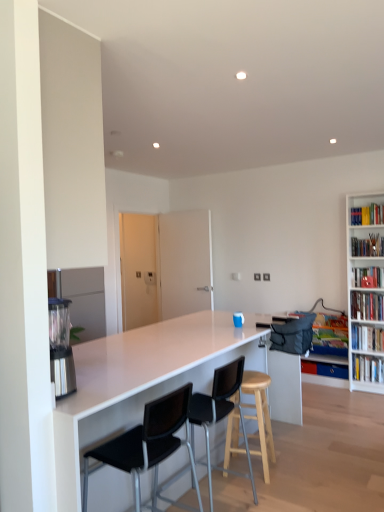
This screenshot has height=512, width=384. What do you see at coordinates (220, 414) in the screenshot? I see `black plastic chair at center, arranged as the 2th chair when viewed from the front` at bounding box center [220, 414].

Where is `black plastic chair at center, acting as the first chair starting from the back`? The height and width of the screenshot is (512, 384). black plastic chair at center, acting as the first chair starting from the back is located at coordinates (220, 414).

Locate an element on the screen. This screenshot has height=512, width=384. white matte bookshelf at right, positioned as the 3th book in bottom-to-top order is located at coordinates (367, 338).

In order to click on hardcover book at right, acting as the 6th book starting from the top in this screenshot , I will do `click(367, 368)`.

This screenshot has width=384, height=512. I want to click on black plastic chair at center, the first chair when ordered from front to back, so click(x=148, y=444).

Describe the element at coordinates (61, 347) in the screenshot. I see `stainless steel blender at left` at that location.

This screenshot has height=512, width=384. What do you see at coordinates (367, 276) in the screenshot?
I see `hardcover book at upper right, which is the 3th book from top to bottom` at bounding box center [367, 276].

At what (x,y) coordinates should I click in order to perform the action: click on black plastic chair at center, acting as the first chair starting from the back. Please return your answer as a coordinate pair (x, y). The height and width of the screenshot is (512, 384). Looking at the image, I should click on (220, 414).

Does point (261, 396) come farther from viewer compared to point (342, 376)?

No.

Is light wood stool at center positioned far away from hardcover book at center, placed as the first book when sorted from bottom to top?

Indeed, light wood stool at center is not near hardcover book at center, placed as the first book when sorted from bottom to top.

In the scene shown: From the image's perspective, is light wood stool at center over hardcover book at center, which appears as the 7th book when viewed from the top?

Yes.

Is light wood stool at center in front of hardcover book at center, which appears as the 7th book when viewed from the top?

Yes, the depth of light wood stool at center is less than that of hardcover book at center, which appears as the 7th book when viewed from the top.

Which of these two, hardcover book at right, acting as the 6th book starting from the top, or light wood stool at center, stands taller?

light wood stool at center.

Is hardcover book at right, acting as the 6th book starting from the top, oriented towards light wood stool at center?

Yes.

Considering the relative sizes of hardcover book at right, acting as the 6th book starting from the top, and light wood stool at center in the image provided, is hardcover book at right, acting as the 6th book starting from the top, thinner than light wood stool at center?

Correct, the width of hardcover book at right, acting as the 6th book starting from the top, is less than that of light wood stool at center.

Considering the relative positions of hardcover book at right, acting as the 6th book starting from the top, and light wood stool at center in the image provided, is hardcover book at right, acting as the 6th book starting from the top, in front of light wood stool at center?

No, hardcover book at right, acting as the 6th book starting from the top, is further to the viewer.

Considering the sizes of hardcover book at center, which appears as the 7th book when viewed from the top, and light wood stool at center in the image, is hardcover book at center, which appears as the 7th book when viewed from the top, taller or shorter than light wood stool at center?

Clearly, hardcover book at center, which appears as the 7th book when viewed from the top, is shorter compared to light wood stool at center.

Which is correct: hardcover book at center, placed as the first book when sorted from bottom to top, is inside light wood stool at center, or outside of it?

hardcover book at center, placed as the first book when sorted from bottom to top, is outside light wood stool at center.

This screenshot has width=384, height=512. What are the coordinates of `the 7th book behind the light wood stool at center` in the screenshot? It's located at (324, 369).

Considering the positions of points (356, 239) and (357, 211), is point (356, 239) farther from camera compared to point (357, 211)?

No.

From a real-world perspective, which object rests below the other?

hardcover book at upper right, which appears as the second book when viewed from the top, is physically lower.

Considering the sizes of objects hardcover book at upper right, which is the sixth book in bottom-to-top order, and hardcover book at upper right, the 7th book in the bottom-to-top sequence, in the image provided, who is bigger, hardcover book at upper right, which is the sixth book in bottom-to-top order, or hardcover book at upper right, the 7th book in the bottom-to-top sequence,?

hardcover book at upper right, which is the sixth book in bottom-to-top order, is bigger.

Are hardcover book at upper right, the 7th book in the bottom-to-top sequence, and white matte bookshelf at right, marked as the fifth book in a top-to-bottom arrangement, located far from each other?

Absolutely, hardcover book at upper right, the 7th book in the bottom-to-top sequence, is distant from white matte bookshelf at right, marked as the fifth book in a top-to-bottom arrangement.

I want to click on book that is the 4th object directly below the hardcover book at upper right, the 7th book in the bottom-to-top sequence (from a real-world perspective), so click(367, 338).

From the image's perspective, is hardcover book at upper right, which is the 1th book in top-to-bottom order, above or below white matte bookshelf at right, marked as the fifth book in a top-to-bottom arrangement?

Based on their image positions, hardcover book at upper right, which is the 1th book in top-to-bottom order, is located above white matte bookshelf at right, marked as the fifth book in a top-to-bottom arrangement.

Can you confirm if hardcover book at upper right, the 7th book in the bottom-to-top sequence, is wider than white matte bookshelf at right, positioned as the 3th book in bottom-to-top order?

No.

Looking at this image, how much distance is there between white matte bookshelf at right, which appears as the 4th book when ordered from the bottom, and white matte bookshelf at right, positioned as the 3th book in bottom-to-top order?

They are 8.40 inches apart.

Considering the sizes of objects white matte bookshelf at right, acting as the 4th book starting from the top, and white matte bookshelf at right, positioned as the 3th book in bottom-to-top order, in the image provided, who is thinner, white matte bookshelf at right, acting as the 4th book starting from the top, or white matte bookshelf at right, positioned as the 3th book in bottom-to-top order,?

white matte bookshelf at right, positioned as the 3th book in bottom-to-top order.

Is the position of white matte bookshelf at right, acting as the 4th book starting from the top, more distant than that of white matte bookshelf at right, positioned as the 3th book in bottom-to-top order?

No, white matte bookshelf at right, acting as the 4th book starting from the top, is closer to the viewer.

From the image's perspective, is white matte bookshelf at right, acting as the 4th book starting from the top, on white matte bookshelf at right, positioned as the 3th book in bottom-to-top order?

Yes.

Is hardcover book at upper right, which is the 3th book from top to bottom, aimed at hardcover book at upper right, which appears as the second book when viewed from the top?

No.

Considering the sizes of objects hardcover book at upper right, which is the 3th book from top to bottom, and hardcover book at upper right, which appears as the second book when viewed from the top, in the image provided, who is smaller, hardcover book at upper right, which is the 3th book from top to bottom, or hardcover book at upper right, which appears as the second book when viewed from the top,?

hardcover book at upper right, which is the 3th book from top to bottom, is smaller.

Looking at this image, can you tell me how much hardcover book at upper right, which is the 3th book from top to bottom, and hardcover book at upper right, which appears as the second book when viewed from the top, differ in facing direction?

hardcover book at upper right, which is the 3th book from top to bottom, and hardcover book at upper right, which appears as the second book when viewed from the top, are facing 0.272 degrees away from each other.

Locate an element on the screen. The height and width of the screenshot is (512, 384). stool that is on the left side of hardcover book at center, placed as the first book when sorted from bottom to top is located at coordinates (260, 416).

The width and height of the screenshot is (384, 512). I want to click on book that is the 1st object directly below the light wood stool at center (from a real-world perspective), so click(367, 368).

Looking at the image, which one is located closer to hardcover book at center, placed as the first book when sorted from bottom to top, black plastic chair at center, acting as the first chair starting from the back, or hardcover book at upper right, the 7th book in the bottom-to-top sequence?

hardcover book at upper right, the 7th book in the bottom-to-top sequence, lies closer to hardcover book at center, placed as the first book when sorted from bottom to top, than the other object.

Considering their positions, is hardcover book at upper right, the 7th book in the bottom-to-top sequence, positioned closer to black plastic chair at center, acting as the first chair starting from the back, than black plastic chair at center, the first chair when ordered from front to back?

Among the two, black plastic chair at center, the first chair when ordered from front to back, is located nearer to black plastic chair at center, acting as the first chair starting from the back.

From the image, which object appears to be farther from hardcover book at center, which appears as the 7th book when viewed from the top, hardcover book at upper right, the 7th book in the bottom-to-top sequence, or white glossy countertop at center?

The object further to hardcover book at center, which appears as the 7th book when viewed from the top, is white glossy countertop at center.

Which object lies nearer to the anchor point hardcover book at upper right, the fifth book when ordered from bottom to top, white matte bookshelf at right, positioned as the 3th book in bottom-to-top order, or hardcover book at center, placed as the first book when sorted from bottom to top?

Among the two, white matte bookshelf at right, positioned as the 3th book in bottom-to-top order, is located nearer to hardcover book at upper right, the fifth book when ordered from bottom to top.

From the image, which object appears to be nearer to hardcover book at upper right, which appears as the second book when viewed from the top, hardcover book at upper right, the fifth book when ordered from bottom to top, or black plastic chair at center, the first chair when ordered from front to back?

hardcover book at upper right, the fifth book when ordered from bottom to top, lies closer to hardcover book at upper right, which appears as the second book when viewed from the top, than the other object.

Looking at the image, which one is located further to black plastic chair at center, arranged as the 2th chair when viewed from the front, white matte bookshelf at right, which appears as the 4th book when ordered from the bottom, or hardcover book at upper right, which is the 1th book in top-to-bottom order?

hardcover book at upper right, which is the 1th book in top-to-bottom order.

Based on their spatial positions, is stainless steel blender at left or white matte bookshelf at right, marked as the fifth book in a top-to-bottom arrangement, further from light wood stool at center?

white matte bookshelf at right, marked as the fifth book in a top-to-bottom arrangement.

Looking at the image, which one is located further to hardcover book at upper right, the fifth book when ordered from bottom to top, white glossy countertop at center or light wood stool at center?

white glossy countertop at center is positioned further to the anchor hardcover book at upper right, the fifth book when ordered from bottom to top.

I want to click on appliance between white glossy countertop at center and hardcover book at upper right, which appears as the second book when viewed from the top, from front to back, so click(x=61, y=347).

Locate an element on the screen. The image size is (384, 512). appliance between black plastic chair at center, the first chair when ordered from front to back, and white matte bookshelf at right, marked as the fifth book in a top-to-bottom arrangement, along the z-axis is located at coordinates (61, 347).

Where is `book located between light wood stool at center and white matte bookshelf at right, positioned as the 3th book in bottom-to-top order, in the depth direction`? book located between light wood stool at center and white matte bookshelf at right, positioned as the 3th book in bottom-to-top order, in the depth direction is located at coordinates (367, 306).

Image resolution: width=384 pixels, height=512 pixels. Identify the location of chair between stainless steel blender at left and black plastic chair at center, arranged as the 2th chair when viewed from the front, vertically. (148, 444).